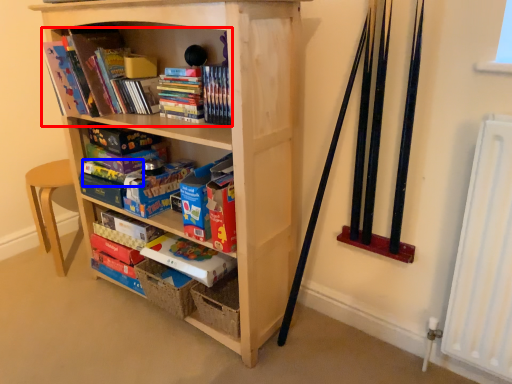
Question: Which object is further to the camera taking this photo, book (highlighted by a red box) or paperback book (highlighted by a blue box)?

Choices:
 (A) book
 (B) paperback book

Answer: (B)